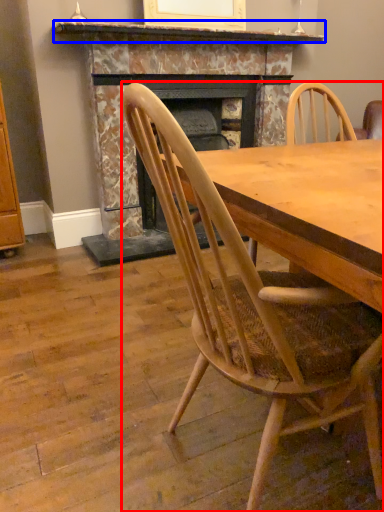
Question: Which object appears closest to the camera in this image, chair (highlighted by a red box) or mantle (highlighted by a blue box)?

Choices:
 (A) chair
 (B) mantle

Answer: (A)